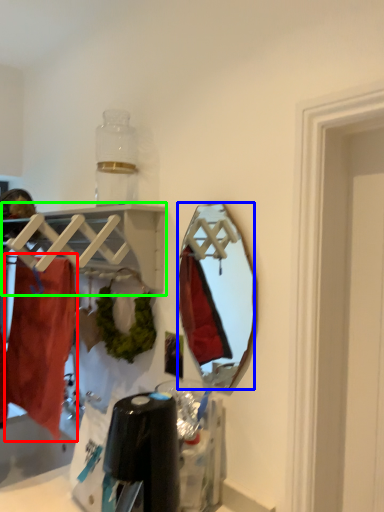
Question: Which object is the closest to the clothing (highlighted by a red box)? Choose among these: mirror (highlighted by a blue box) or shelf (highlighted by a green box).

Choices:
 (A) mirror
 (B) shelf

Answer: (B)